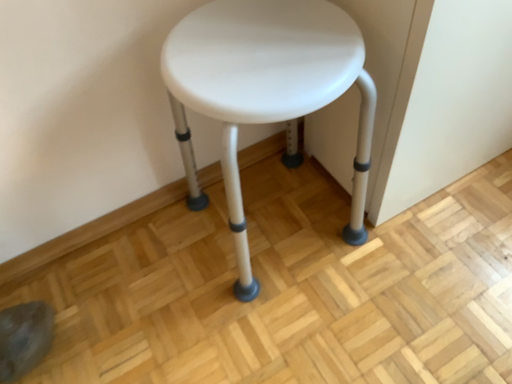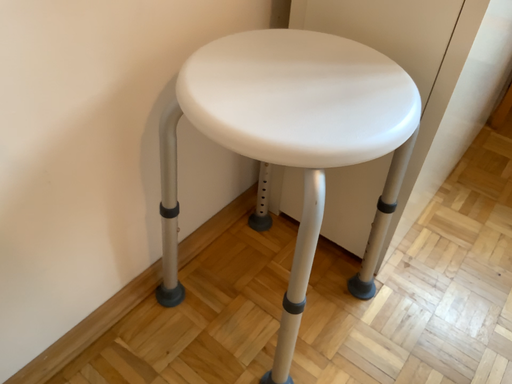
Question: Which way did the camera rotate in the video?

Choices:
 (A) rotated downward
 (B) rotated upward

Answer: (B)